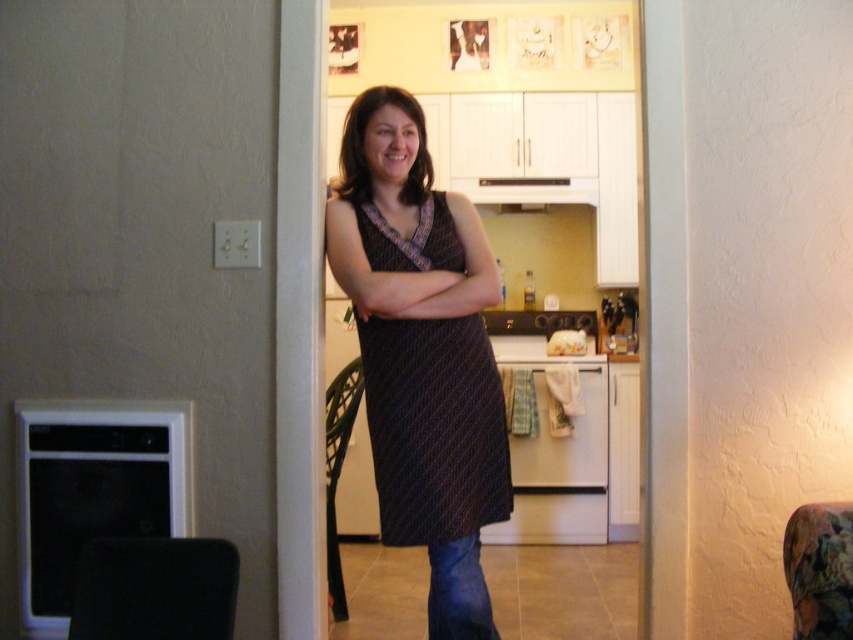
You are a fashion designer observing the woman in the scene. You notice both the dark textured dress at center and the matte black dress at center. Which dress is visible on the woman?

The dark textured dress at center is visible because it is in front of the matte black dress at center.

What is located at the coordinates point (434, 428) in the image?

The dark textured dress at center is located at point (434, 428).

You are a fashion designer observing a woman standing in a doorway. You notice she is wearing two dresses described as dark textured dress at center and matte black dress at center. Which dress is positioned lower on her body?

The dark textured dress at center is located below the matte black dress at center, so the dark textured dress at center is positioned lower on her body.